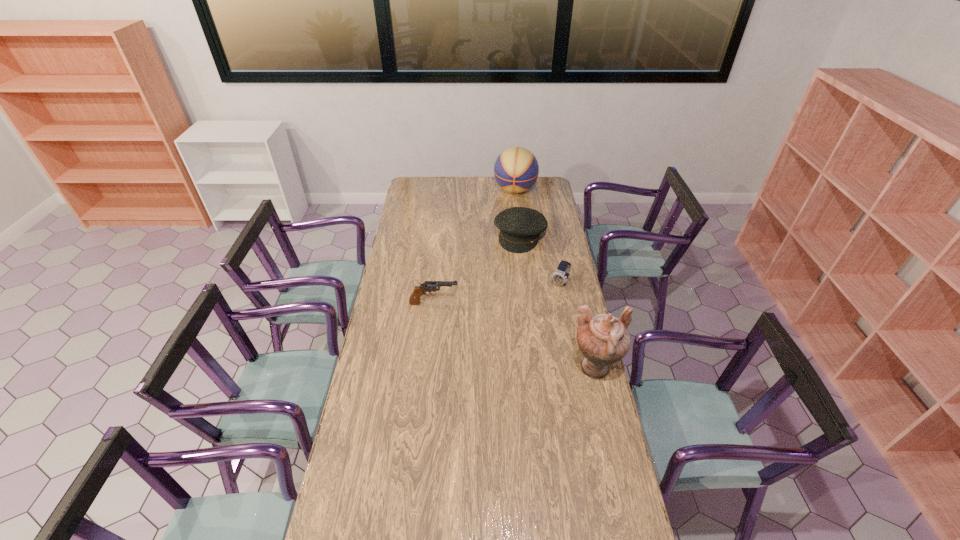
This screenshot has height=540, width=960. I want to click on beret at the right edge, so click(x=520, y=227).

You are a GUI agent. You are given a task and a screenshot of the screen. Output one action in this format:
    pyautogui.click(x=<x>, y=<y>)
    Task: Click on the watch located at the right edge
    The height and width of the screenshot is (540, 960).
    Given the screenshot: What is the action you would take?
    pyautogui.click(x=560, y=277)

Where is `basketball positioned at the right edge`? basketball positioned at the right edge is located at coordinates (516, 169).

Identify the location of object that is at the far right corner. (516, 169).

The image size is (960, 540). In the image, there is a desktop. What are the coordinates of `vacant space at the far edge` in the screenshot? It's located at (482, 191).

Where is `vacant space at the near edge`? vacant space at the near edge is located at coordinates (444, 509).

In the image, there is a desktop. Identify the location of vacant space at the left edge. This screenshot has height=540, width=960. coord(409,237).

In the image, there is a desktop. Identify the location of vacant space at the right edge. (558, 266).

Find the location of a particular element. The width and height of the screenshot is (960, 540). vacant space at the far left corner of the desktop is located at coordinates (434, 180).

In order to click on vacant space at the far right corner in this screenshot , I will do `click(550, 184)`.